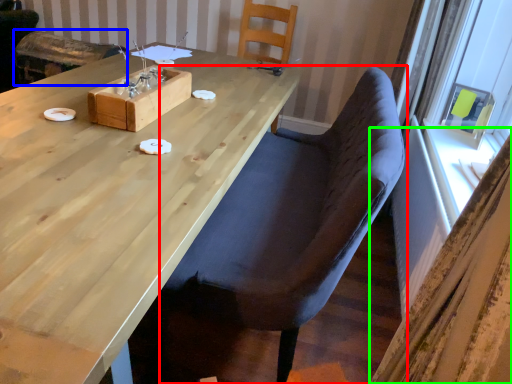
Question: Which object is the farthest from chair (highlighted by a red box)? Choose among these: armchair (highlighted by a blue box) or curtain (highlighted by a green box).

Choices:
 (A) armchair
 (B) curtain

Answer: (A)